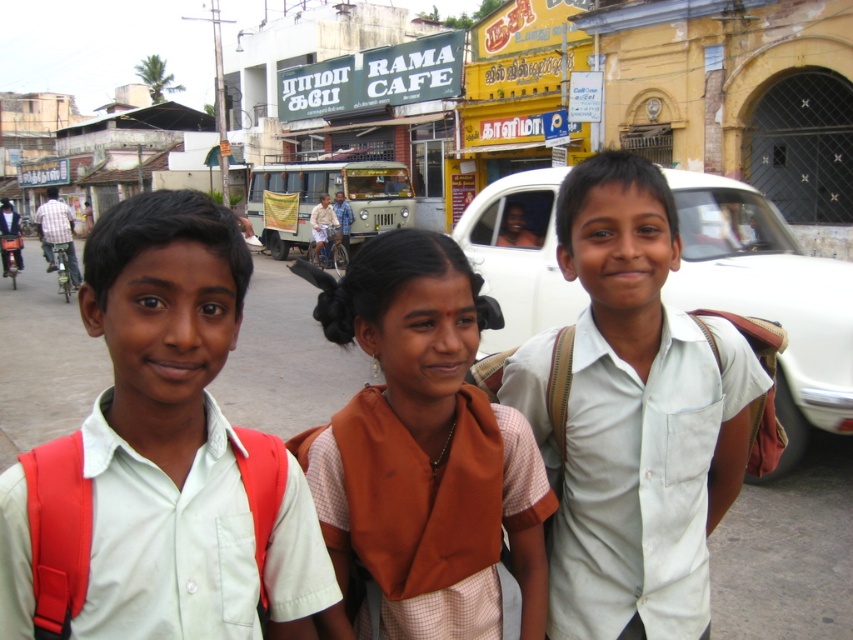
You are a delivery person who needs to deliver a package to the address located at point (680, 627). You are currently at the point 0.000, 0.000. The map shows that the distance between your current location and the destination is 1.87 meters. Your delivery cart can only move in straight lines and has a maximum range of 2 meters. Can you reach the destination without exceeding your cart s range?

The distance between your current location and the destination at point (680, 627) is 1.87 meters, which is within the delivery cart s maximum range of 2 meters. Yes, you can reach the destination without exceeding the cart s range.

You are a photographer trying to capture both the light green shirt at center and the white cotton shirt at center in a single frame. Given their sizes, which one should you focus on to ensure both are visible clearly?

The light green shirt at center is larger than the white cotton shirt at center, so you should focus on the light green shirt at center to ensure both are visible clearly.

From the picture: You are a photographer trying to capture the orange fabric sari at center in your shot. Based on its coordinates, where exactly should you focus your camera?

The orange fabric sari at center is located at coordinates point (426, 445), so you should focus your camera there.